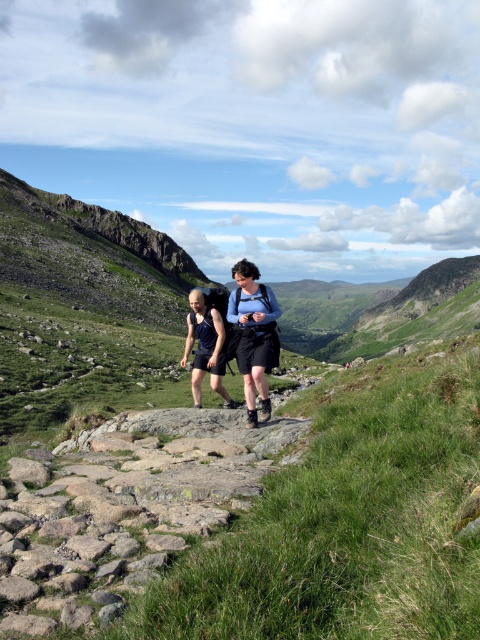
You are a hiker trying to navigate the rocky path between the green grassy at center and the matte blue backpack at center. Which direction should you move to reach the grassy area from the backpack?

The green grassy at center is positioned on the right side of matte blue backpack at center, so to reach the grassy area from the backpack, you should move to the right.

You are a hiker following the two individuals in the image. You want to step onto the green grassy area at center. Given that the matte black shorts at center are part of the person in front of you, can you step onto the green grassy at center without stepping on their shorts?

The green grassy at center is in front of matte black shorts at center, so stepping onto the green grassy at center would place your foot in front of the person wearing the matte black shorts at center. Therefore, you can step onto the green grassy at center without stepping on their shorts.

From the picture: You are navigating a narrow mountain path and see two markers at coordinates point [367,426] and point [253,300]. Which marker is closer to your current position if you are following the path ahead?

Point [367,426] is in front of point [253,300], so the marker at point [367,426] is closer to your current position when following the path ahead.